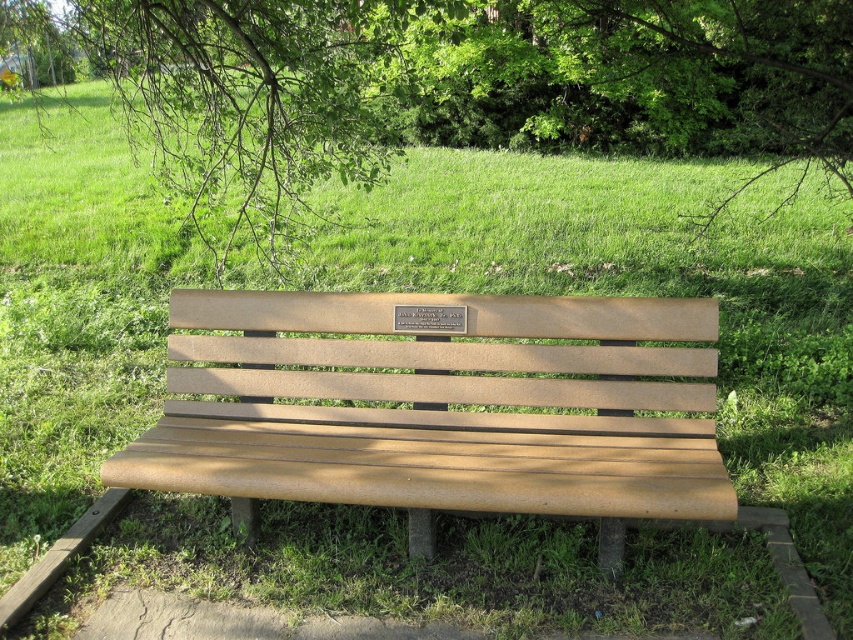
Question: Which of the following is the farthest from the observer?

Choices:
 (A) (654, 400)
 (B) (86, 44)
 (C) (463, 332)

Answer: (B)

Question: Which point is farther to the camera?

Choices:
 (A) (303, 134)
 (B) (431, 324)

Answer: (A)

Question: Is green leafy tree at upper center to the right of bronze plaque at center from the viewer's perspective?

Choices:
 (A) yes
 (B) no

Answer: (B)

Question: Which point is closer to the camera taking this photo?

Choices:
 (A) (398, 317)
 (B) (675, 417)
 (C) (403, 12)

Answer: (A)

Question: Does light brown wood bench at center appear under bronze plaque at center?

Choices:
 (A) no
 (B) yes

Answer: (B)

Question: Is green leafy tree at upper center further to camera compared to bronze plaque at center?

Choices:
 (A) yes
 (B) no

Answer: (A)